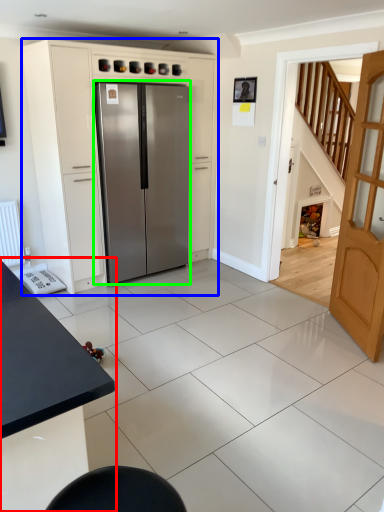
Question: Estimate the real-world distances between objects in this image. Which object is closer to table (highlighted by a red box), cabinetry (highlighted by a blue box) or refrigerator (highlighted by a green box)?

Choices:
 (A) cabinetry
 (B) refrigerator

Answer: (B)